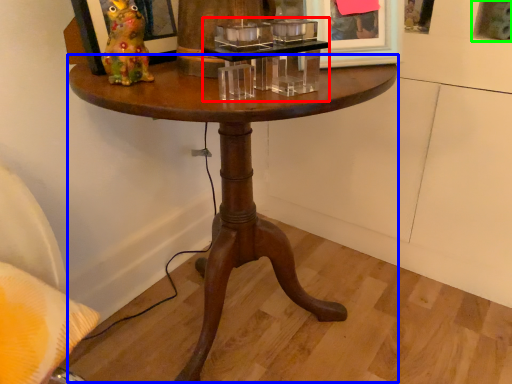
Question: Considering the real-world distances, which object is closest to candle holder (highlighted by a red box)? coffee table (highlighted by a blue box) or picture frame (highlighted by a green box).

Choices:
 (A) coffee table
 (B) picture frame

Answer: (A)